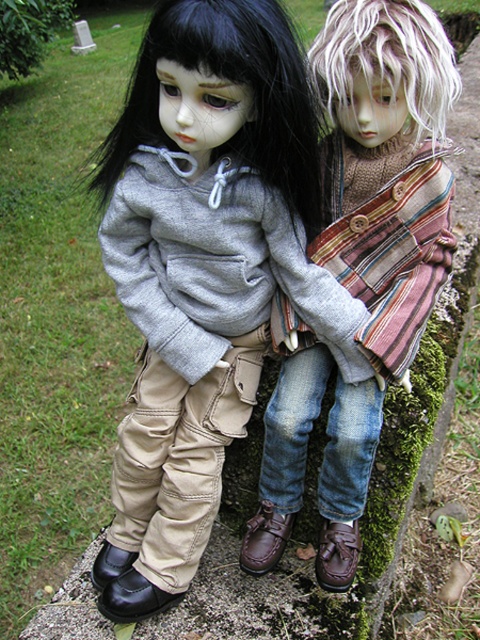
Question: Does matte gray hoodie at center lie in front of striped woolen scarf at center?

Choices:
 (A) yes
 (B) no

Answer: (A)

Question: Can you confirm if matte gray hoodie at center is positioned to the left of striped woolen scarf at center?

Choices:
 (A) yes
 (B) no

Answer: (A)

Question: Does matte gray hoodie at center appear under striped woolen scarf at center?

Choices:
 (A) yes
 (B) no

Answer: (A)

Question: Which of the following is the closest to the observer?

Choices:
 (A) matte gray hoodie at center
 (B) striped woolen scarf at center

Answer: (A)